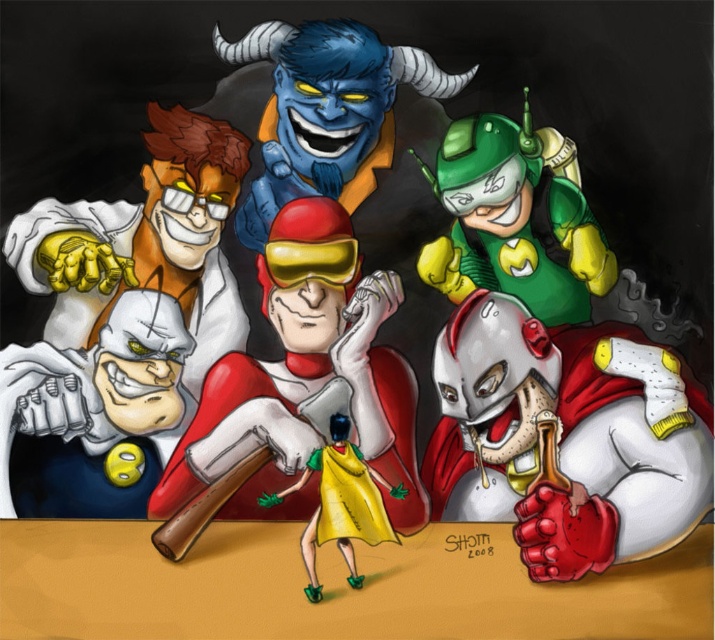
Question: Which point is closer to the camera?

Choices:
 (A) (290, 492)
 (B) (665, 547)

Answer: (A)

Question: Which point is farther to the camera?

Choices:
 (A) (257, 200)
 (B) (399, 483)
 (C) (468, 125)

Answer: (C)

Question: Can you confirm if shiny metallic helmet at lower right is thinner than green matte robot at upper right?

Choices:
 (A) no
 (B) yes

Answer: (A)

Question: Among these points, which one is nearest to the camera?

Choices:
 (A) (518, 292)
 (B) (337, 499)
 (C) (350, 35)

Answer: (B)

Question: Is shiny metallic helmet at lower right smaller than blue rubber demon at upper center?

Choices:
 (A) no
 (B) yes

Answer: (A)

Question: Is green matte robot at upper right bigger than blue rubber demon at upper center?

Choices:
 (A) no
 (B) yes

Answer: (A)